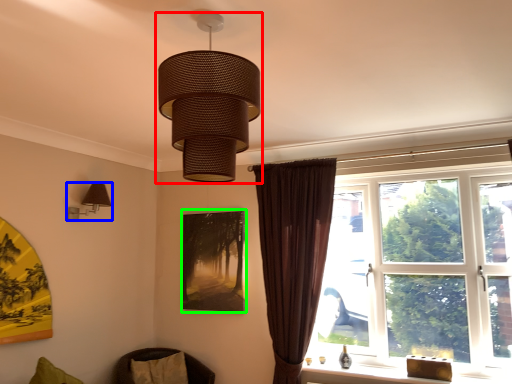
Question: Based on their relative distances, which object is nearer to lamp (highlighted by a red box)? Choose from lamp (highlighted by a blue box) and picture frame (highlighted by a green box).

Choices:
 (A) lamp
 (B) picture frame

Answer: (A)